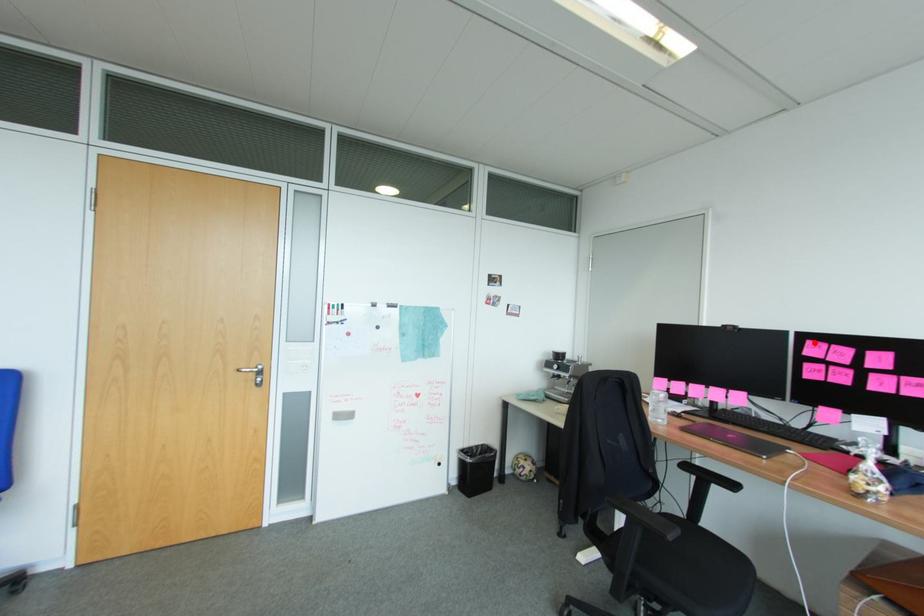
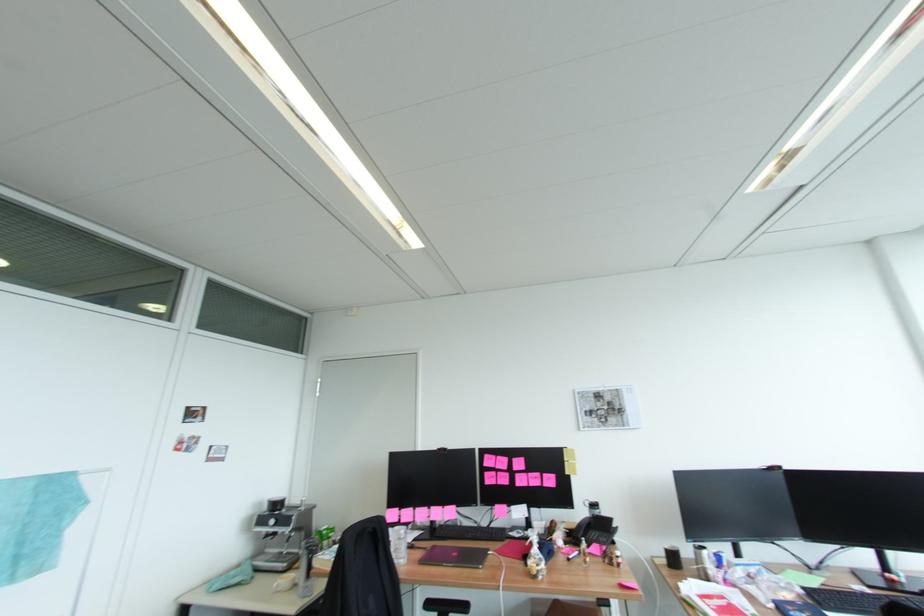
Question: I am providing you with two images of the same scene from different viewpoints. A red point is marked on the first image. At the location where the point appears in image 1, is it still visible in image 2?

Choices:
 (A) Yes
 (B) No

Answer: (A)